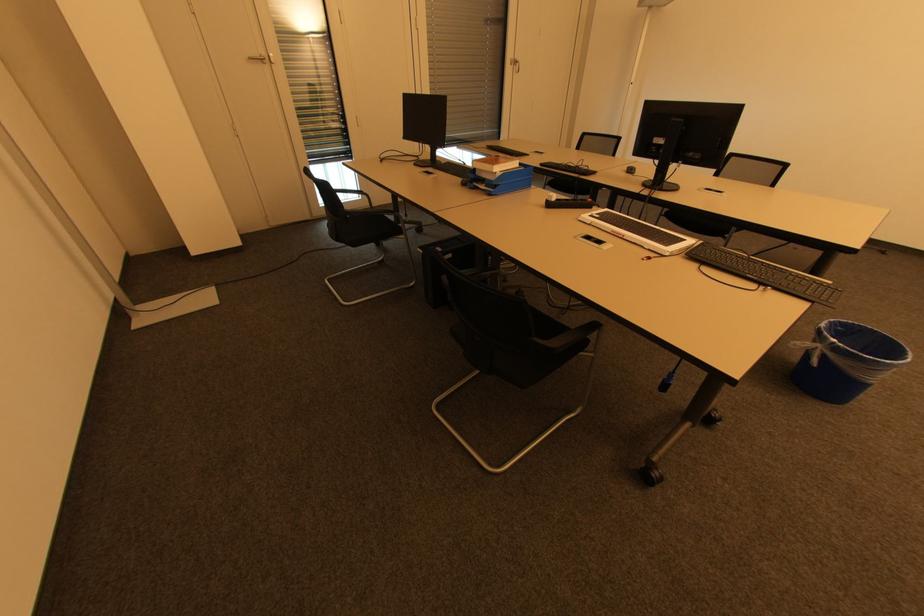
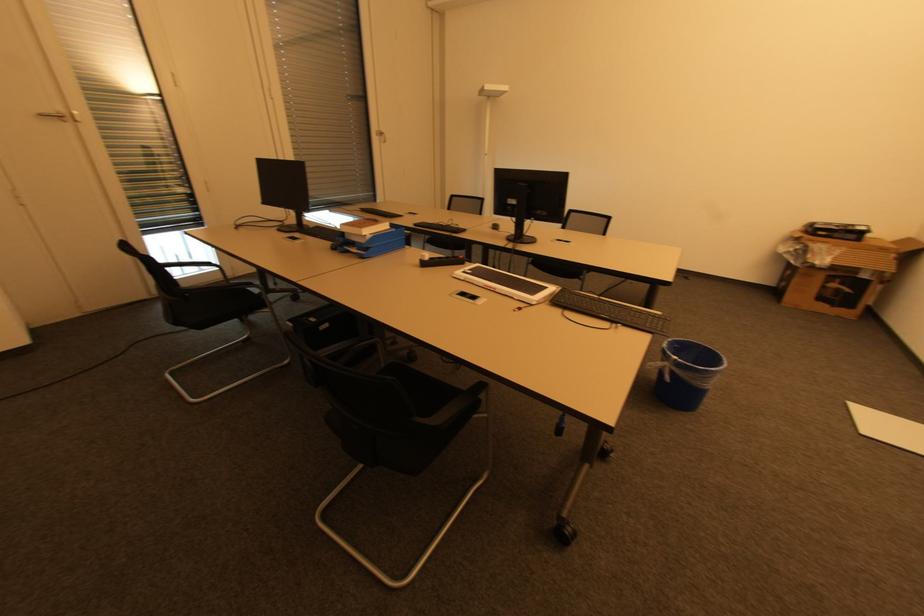
What movement of the cameraman would produce the second image?

The movement direction of the cameraman is right, forward.